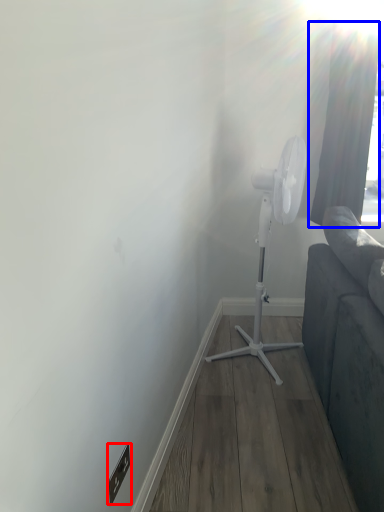
Question: Which of the following is the farthest to the observer, electric outlet (highlighted by a red box) or curtain (highlighted by a blue box)?

Choices:
 (A) electric outlet
 (B) curtain

Answer: (B)